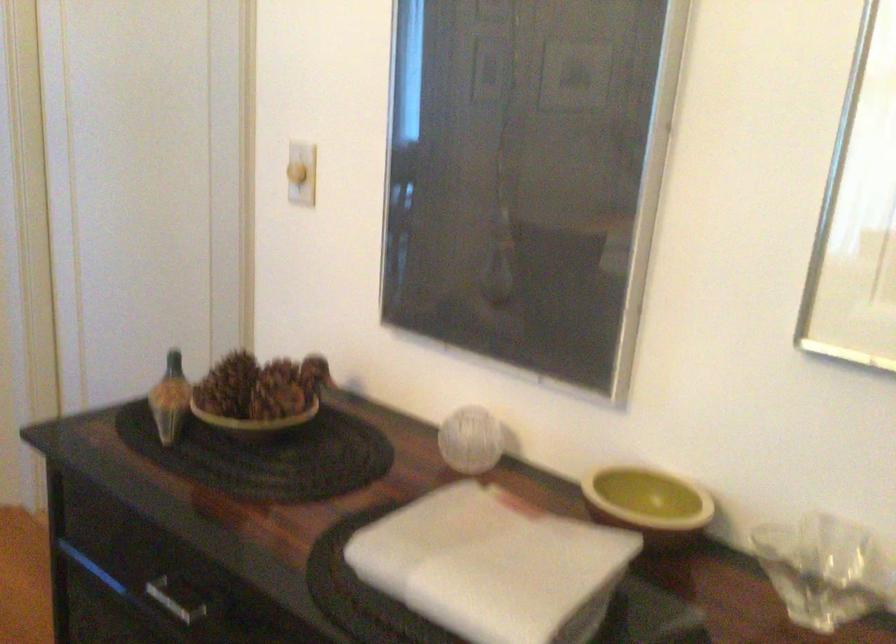
This screenshot has width=896, height=644. What do you see at coordinates (177, 598) in the screenshot? I see `a silver drawer handle` at bounding box center [177, 598].